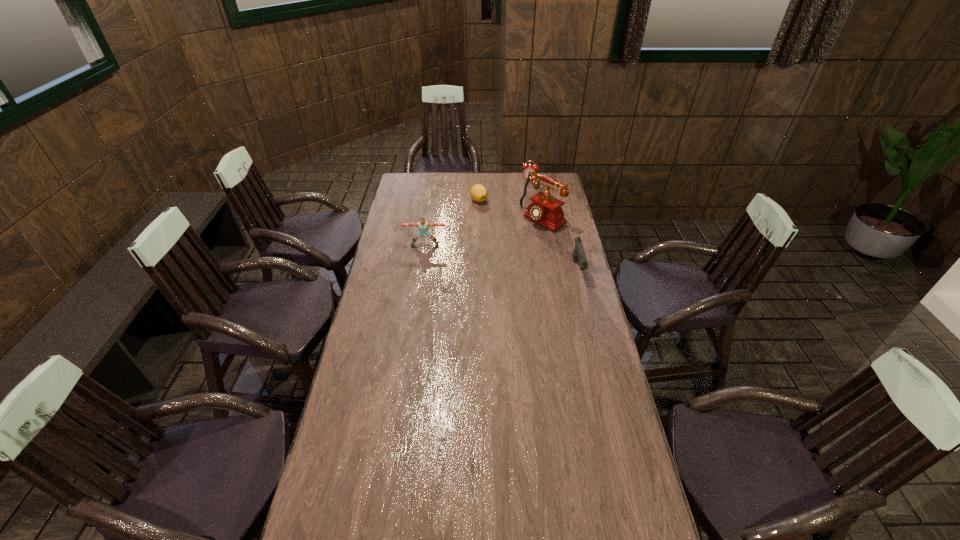
Identify the location of vacant area between the tallest object and the nearest object. The height and width of the screenshot is (540, 960). (561, 244).

Identify the location of free space between the leftmost object and the farthest object. This screenshot has width=960, height=540. (477, 212).

Where is `empty location between the lemon and the alarm clock`? empty location between the lemon and the alarm clock is located at coordinates (504, 190).

Locate an element on the screen. empty location between the pistol and the tallest object is located at coordinates (561, 244).

The image size is (960, 540). Find the location of `free space between the second nearest object and the second farthest object`. free space between the second nearest object and the second farthest object is located at coordinates (452, 222).

This screenshot has height=540, width=960. I want to click on free space between the third nearest object and the puncher, so click(x=484, y=232).

This screenshot has height=540, width=960. What are the coordinates of `object that can be found as the closest to the alarm clock` in the screenshot? It's located at (478, 192).

Identify which object is the closest to the puncher. Please provide its 2D coordinates. Your answer should be formatted as a tuple, i.e. [(x, y)], where the tuple contains the x and y coordinates of a point satisfying the conditions above.

[(478, 192)]